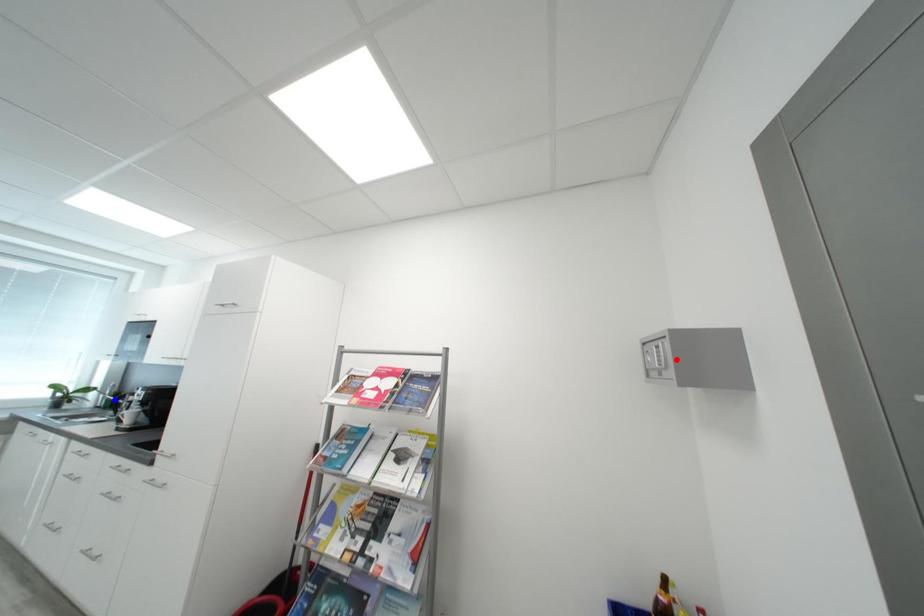
Question: In the image, two points are highlighted. Which point is nearer to the camera? Reply with the corresponding letter.

Choices:
 (A) blue point
 (B) red point

Answer: (B)